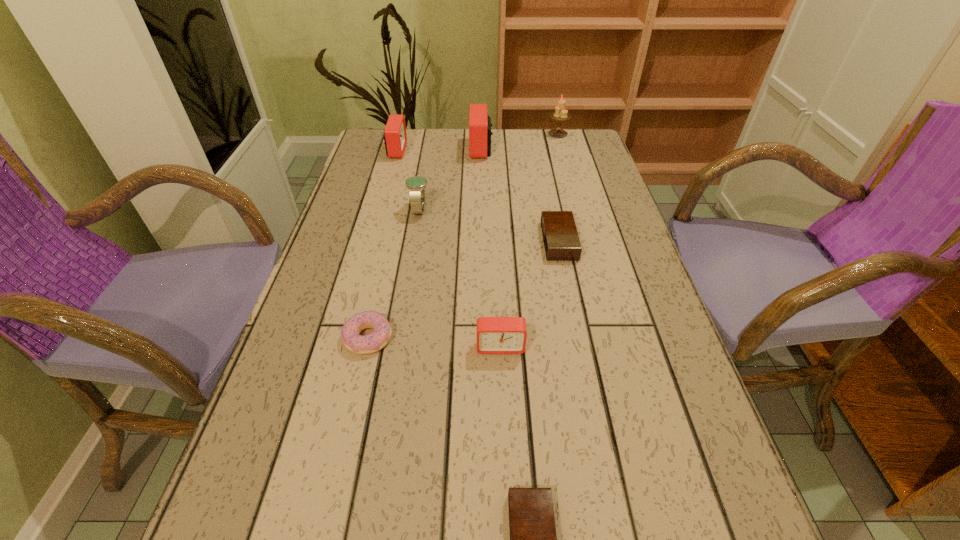
This screenshot has height=540, width=960. What are the coordinates of `vacant space at the left edge of the desktop` in the screenshot? It's located at 363,218.

Identify the location of free space at the right edge of the desktop. Image resolution: width=960 pixels, height=540 pixels. point(588,211).

In order to click on vacant area at the far left corner in this screenshot , I will do `click(382, 150)`.

This screenshot has height=540, width=960. What are the coordinates of `vacant space that is in between the tallest alarm clock and the fourth farthest object` in the screenshot? It's located at [450, 179].

Locate an element on the screen. This screenshot has height=540, width=960. free point between the tallest alarm clock and the candle holder is located at coordinates (519, 141).

The image size is (960, 540). In order to click on free point between the farther black alarm clock and the candle holder in this screenshot , I will do `click(559, 187)`.

The width and height of the screenshot is (960, 540). Identify the location of unoccupied position between the fourth shortest alarm clock and the nearest red alarm clock. (448, 248).

At what (x,y) coordinates should I click in order to perform the action: click on object that is the sixth closest to the farther black alarm clock. Please return your answer as a coordinate pair (x, y). This screenshot has height=540, width=960. Looking at the image, I should click on (395, 138).

Locate which object is the fourth closest to the fourth tallest alarm clock. Please provide its 2D coordinates. Your answer should be formatted as a tuple, i.e. [(x, y)], where the tuple contains the x and y coordinates of a point satisfying the conditions above.

[(361, 344)]

Locate an element on the screen. The height and width of the screenshot is (540, 960). alarm clock object that ranks as the closest to the smaller black alarm clock is located at coordinates (495, 335).